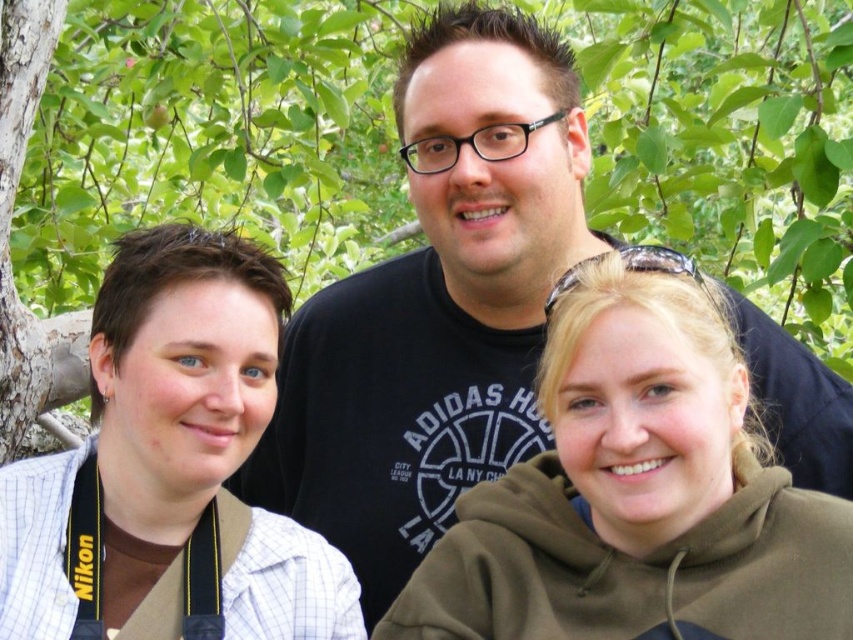
Question: Does green matte hoodie at center appear over white checkered shirt at left?

Choices:
 (A) no
 (B) yes

Answer: (A)

Question: Which point is farther from the camera taking this photo?

Choices:
 (A) coord(471,461)
 (B) coord(120,518)
 (C) coord(729,490)

Answer: (A)

Question: Is black cotton shirt at center to the left of green matte hoodie at center from the viewer's perspective?

Choices:
 (A) yes
 (B) no

Answer: (A)

Question: Is black cotton shirt at center above white checkered shirt at left?

Choices:
 (A) no
 (B) yes

Answer: (B)

Question: Which point appears closest to the camera in this image?

Choices:
 (A) (701, 612)
 (B) (68, 632)
 (C) (508, 67)

Answer: (A)

Question: Estimate the real-world distances between objects in this image. Which object is closer to the black cotton shirt at center?

Choices:
 (A) white checkered shirt at left
 (B) green matte hoodie at center

Answer: (B)